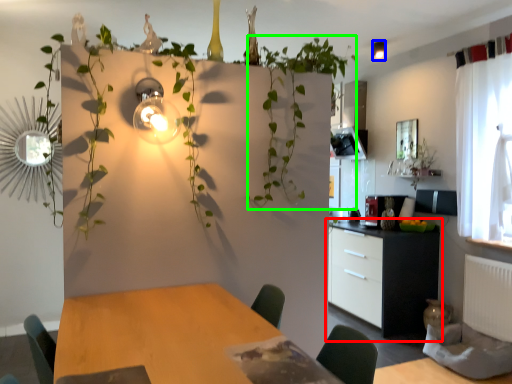
Question: Which object is positioned closest to cabinetry (highlighted by a red box)? Select from light fixture (highlighted by a blue box) and vegetation (highlighted by a green box).

Choices:
 (A) light fixture
 (B) vegetation

Answer: (B)